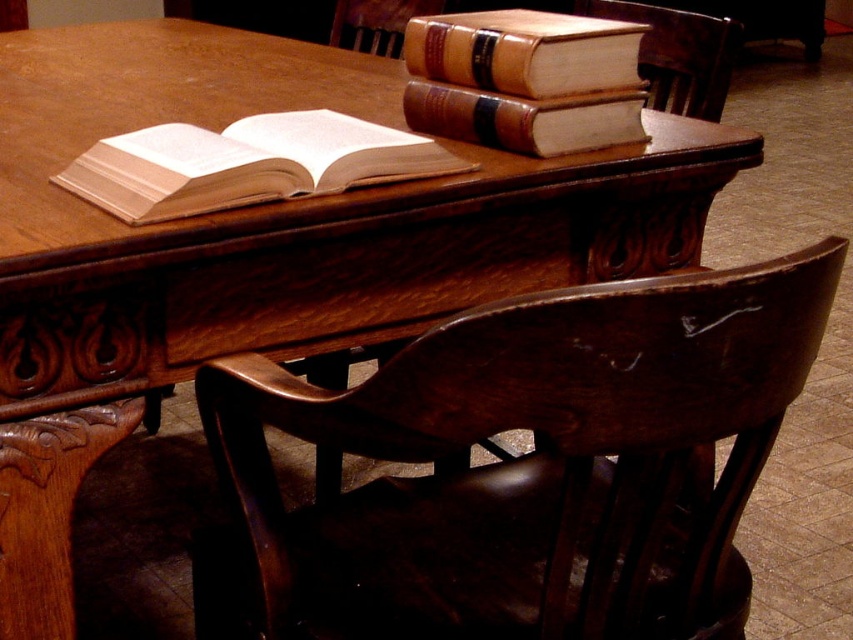
You are organizing items on the desk and want to place a new object between the light beige paper book at center and the wooden chair at center. Is there enough vertical space between them for a 10 cm tall object?

The light beige paper book at center is below the wooden chair at center, so there is vertical space between them. Since the object is only 10 cm tall, it should fit between them.

You are organizing a small reading event and need to place a decorative vase between the brown leather book at upper right and the dark brown wood chair at upper right. Based on their positions, where should you place the vase to ensure it is between them?

The brown leather book at upper right is closer to the viewer than the dark brown wood chair at upper right, so place the vase between them by positioning it closer to the book but still in front of the chair.

You are organizing books on a desk and have two brown leather books. The brown leather book at upper right and the brown leather book at upper center. Which one should you place on the lower shelf if you want to put the bigger one there?

The brown leather book at upper right is bigger than the brown leather book at upper center, so you should place the brown leather book at upper right on the lower shelf.